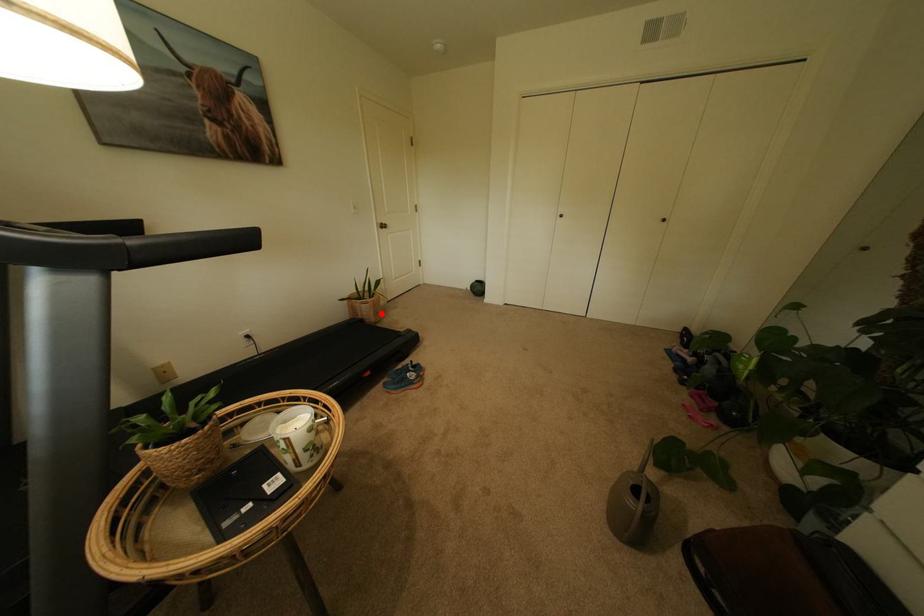
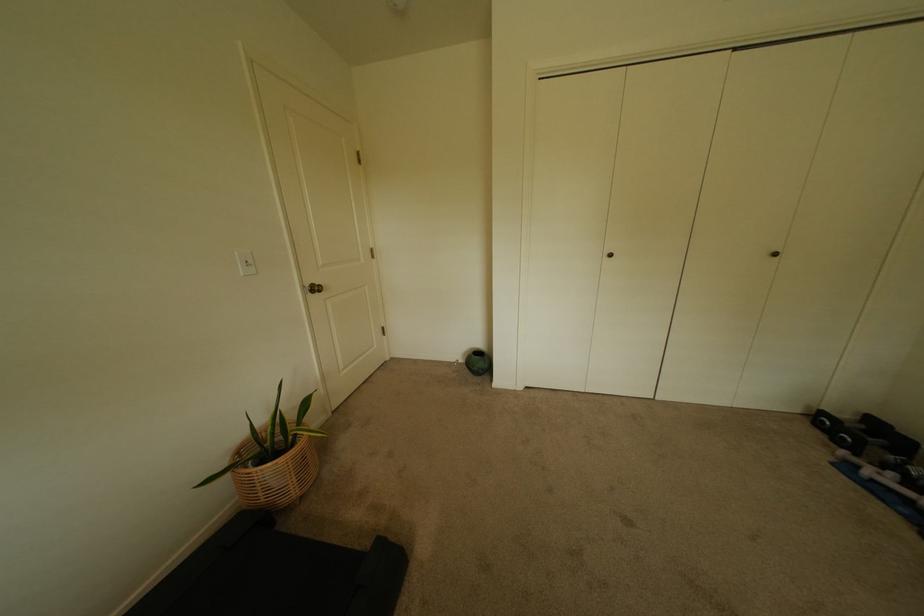
Find the pixel in the second image that matches the highlighted location in the first image.

(302, 480)